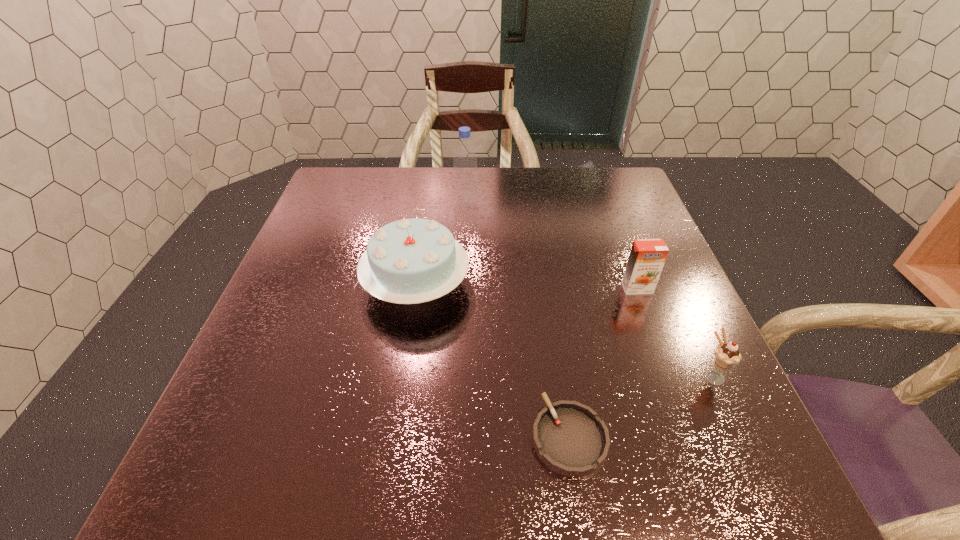
This screenshot has width=960, height=540. Find the location of `vacant space at the right edge`. vacant space at the right edge is located at coordinates (603, 214).

This screenshot has height=540, width=960. In order to click on vacant space at the far left corner of the desktop in this screenshot , I will do `click(370, 200)`.

Locate an element on the screen. The width and height of the screenshot is (960, 540). vacant space at the near left corner is located at coordinates click(201, 479).

The image size is (960, 540). Find the location of `free spot at the far right corner of the desktop`. free spot at the far right corner of the desktop is located at coordinates (577, 181).

Where is `free space between the second tallest object and the ashtray`? free space between the second tallest object and the ashtray is located at coordinates (492, 361).

The width and height of the screenshot is (960, 540). I want to click on free spot between the birthday cake and the fourth object from left to right, so click(527, 286).

At what (x,y) coordinates should I click in order to perform the action: click on vacant point located between the orange juice and the icecream. Please return your answer as a coordinate pair (x, y). The width and height of the screenshot is (960, 540). Looking at the image, I should click on (675, 332).

At what (x,y) coordinates should I click in order to perform the action: click on empty space that is in between the icecream and the nearest object. Please return your answer as a coordinate pair (x, y). Looking at the image, I should click on (641, 406).

Where is `free spot between the orange juice and the nearest object`? This screenshot has height=540, width=960. free spot between the orange juice and the nearest object is located at coordinates (603, 362).

Find the location of `empty space between the second nearest object and the fourth shortest object`. empty space between the second nearest object and the fourth shortest object is located at coordinates (564, 330).